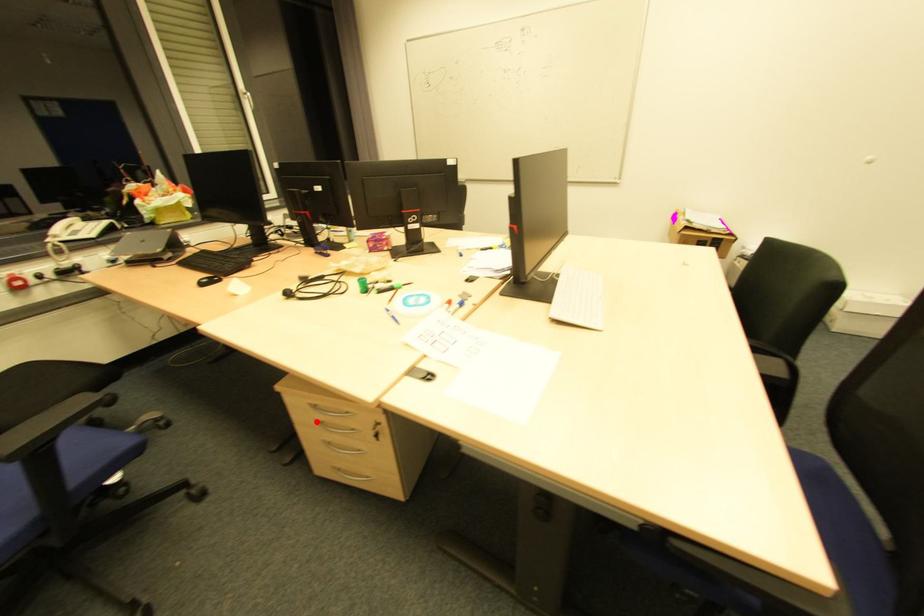
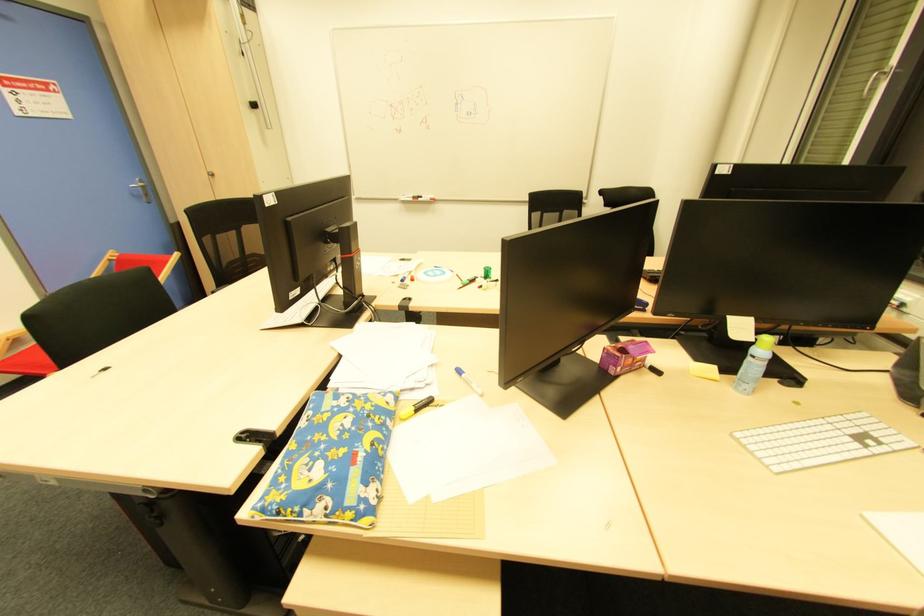
Question: I am providing you with two images of the same scene from different viewpoints. A red point is marked on the first image. At the location where the point appears in image 1, is it still visible in image 2?

Choices:
 (A) Yes
 (B) No

Answer: (B)